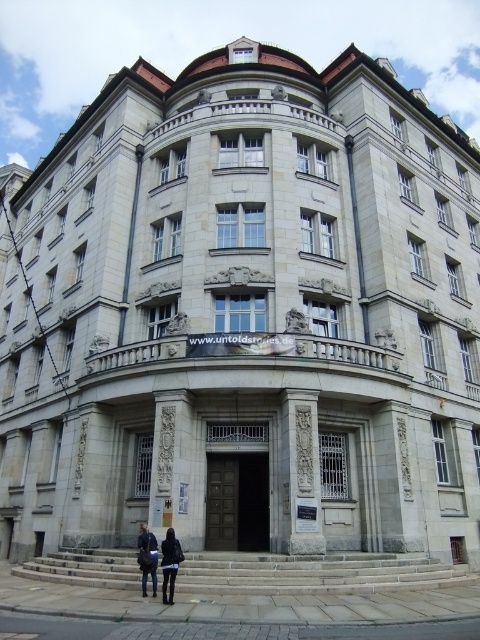
You are standing in front of the building and want to enter. Where is the dark wood door at center located?

The dark wood door at center is located at point (237, 500).

You are a delivery person standing in front of the building and see the dark gray fabric coat at lower center and the dark blue jeans at lower center. Which item is wider?

The dark gray fabric coat at lower center is wider than the dark blue jeans at lower center.

You are a delivery person standing outside the building and see the dark wood door at center and the dark blue leather jacket at lower center. Which object is closer to you?

The dark blue leather jacket at lower center is behind the dark wood door at center, so the dark wood door at center is closer to you.